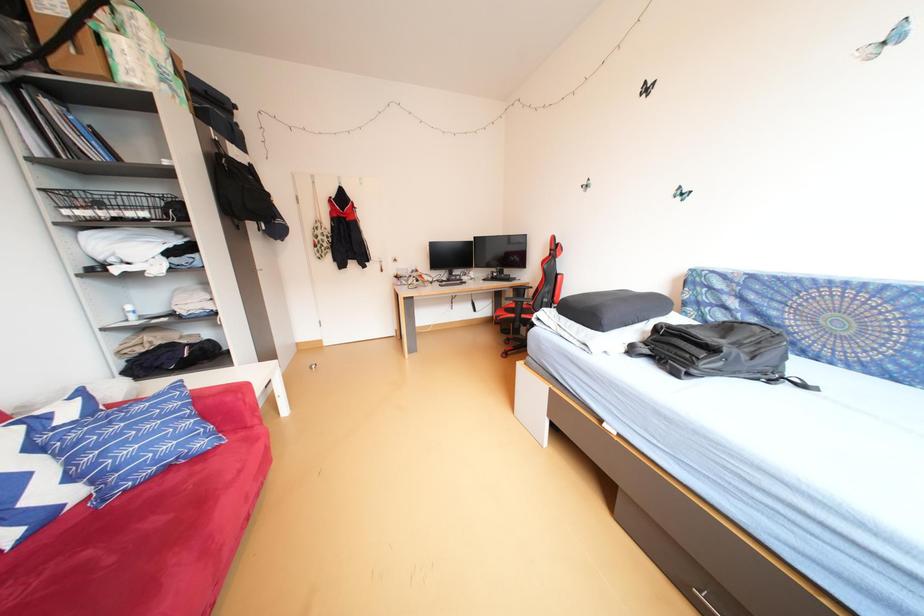
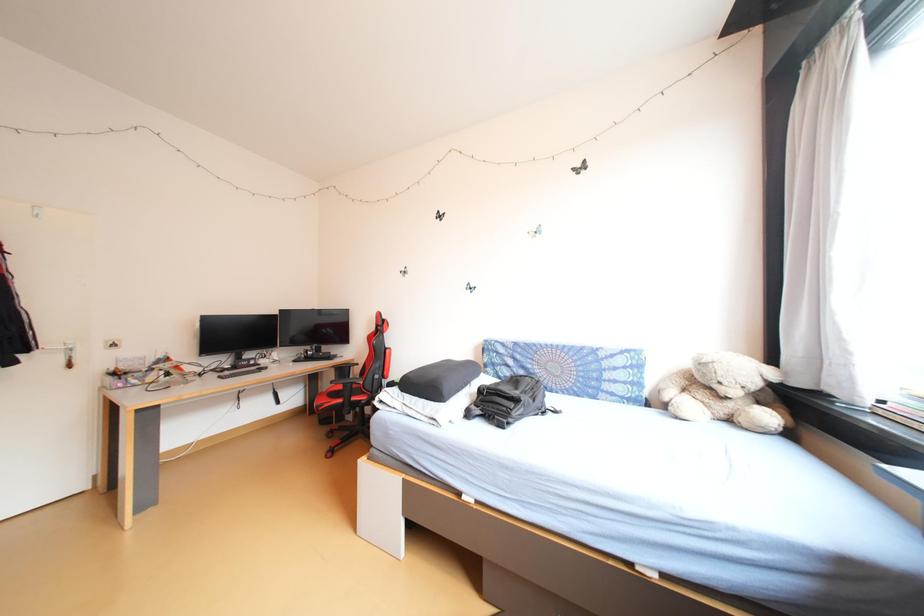
Question: How did the camera likely rotate?

Choices:
 (A) Left
 (B) Right
 (C) Up
 (D) Down

Answer: (B)